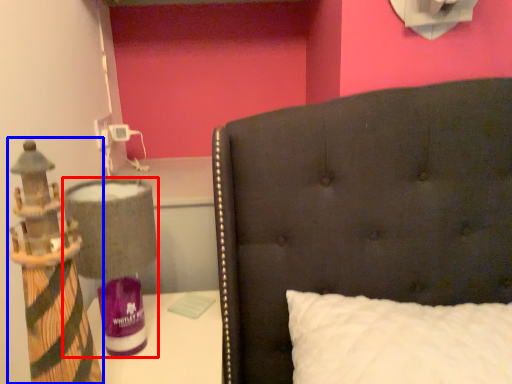
Question: Which point is closer to the camera, table lamp (highlighted by a red box) or toy (highlighted by a blue box)?

Choices:
 (A) table lamp
 (B) toy

Answer: (B)